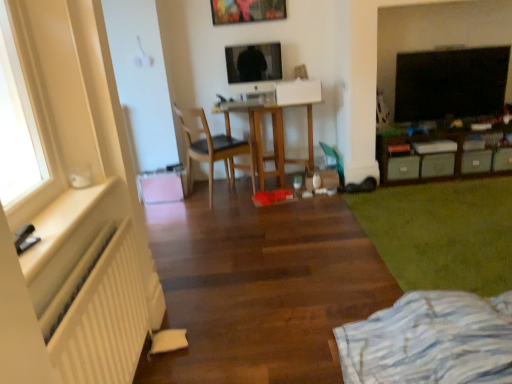
Question: From the image's perspective, is white matte radiator at left located above or below green matte storage unit at right?

Choices:
 (A) above
 (B) below

Answer: (B)

Question: Is white matte radiator at left inside or outside of green matte storage unit at right?

Choices:
 (A) outside
 (B) inside

Answer: (A)

Question: Considering the real-world distances, which object is closest to the green plush carpet at lower right?

Choices:
 (A) green matte storage unit at right
 (B) green matte drawer at right, which is the 4th drawer from right to left
 (C) gray matte drawer at lower right, which is counted as the third drawer, starting from the right
 (D) wooden desk at center
 (E) black glossy tv at upper right

Answer: (A)

Question: Considering the real-world distances, which object is farthest from the green matte drawer at right, which appears as the 2th drawer when viewed from the right?

Choices:
 (A) white matte radiator at left
 (B) black glossy tv at upper right
 (C) gray matte drawer at lower right, which is counted as the third drawer, starting from the right
 (D) white striped fabric at lower right
 (E) light brown wooden chair at center

Answer: (A)